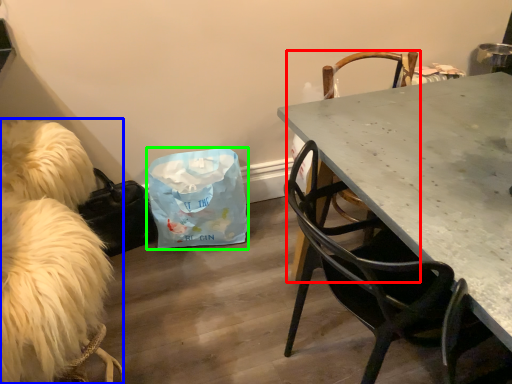
Question: Which object is positioned farthest from chair (highlighted by a red box)? Select from animal (highlighted by a blue box) and diaper bag (highlighted by a green box).

Choices:
 (A) animal
 (B) diaper bag

Answer: (A)